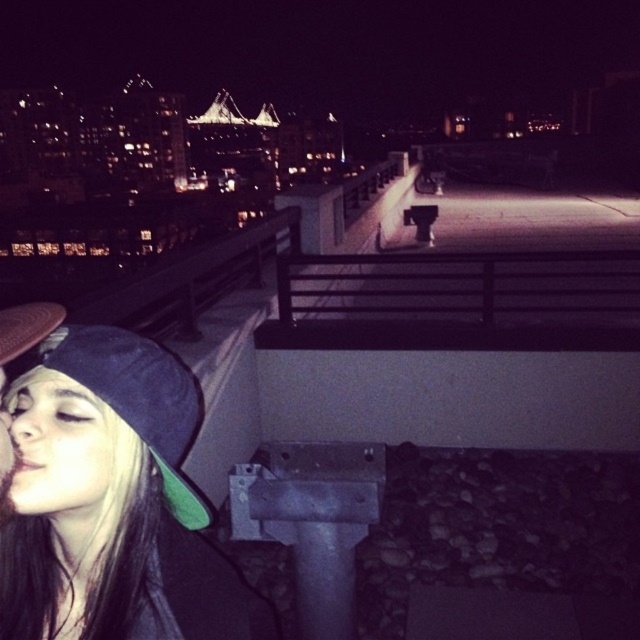
Can you confirm if black matte cap at lower left is taller than matte black cap at lower left?

Indeed, black matte cap at lower left has a greater height compared to matte black cap at lower left.

Between black matte cap at lower left and matte black cap at lower left, which one has less height?

With less height is matte black cap at lower left.

Locate an element on the screen. black matte cap at lower left is located at coordinates (115, 502).